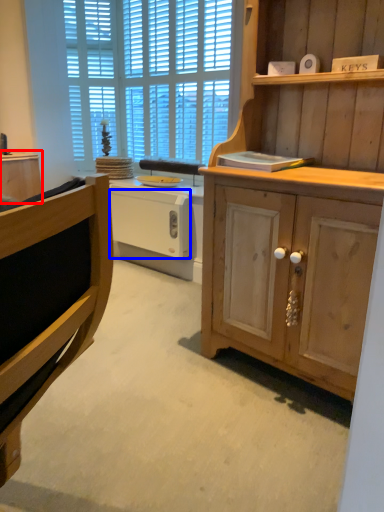
Question: Which object is closer to the camera taking this photo, cabinetry (highlighted by a red box) or drawer (highlighted by a blue box)?

Choices:
 (A) cabinetry
 (B) drawer

Answer: (B)